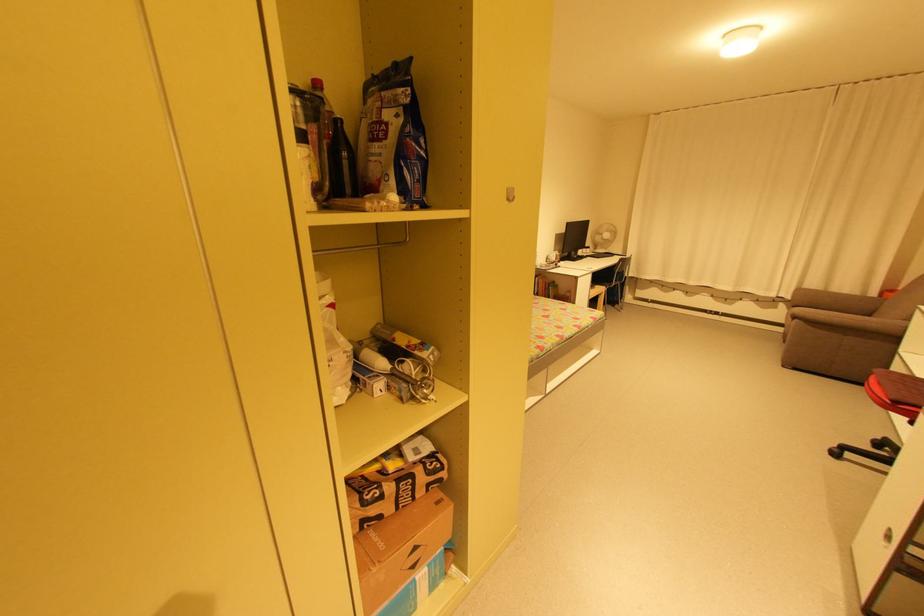
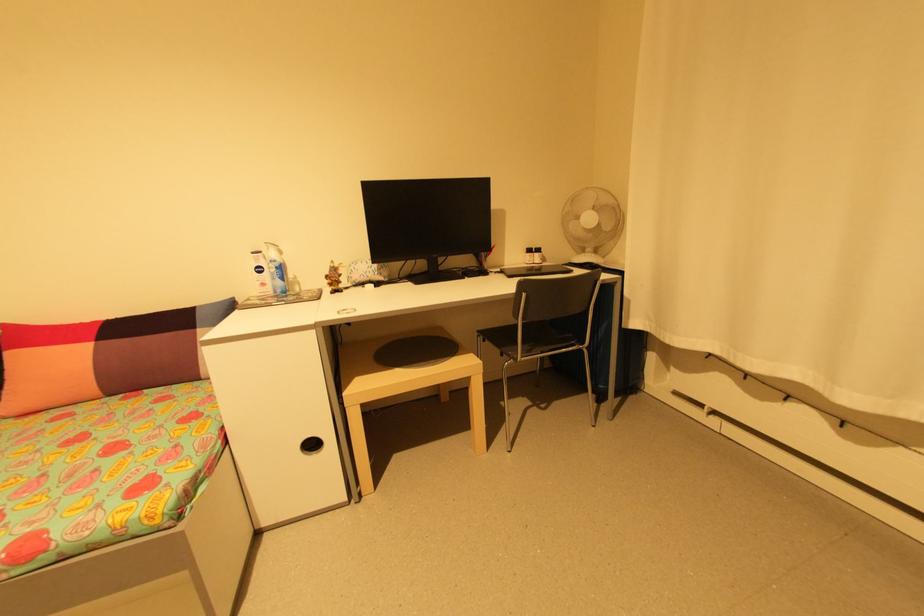
Where in the second image is the point corresponding to point (606, 248) from the first image?

(600, 252)